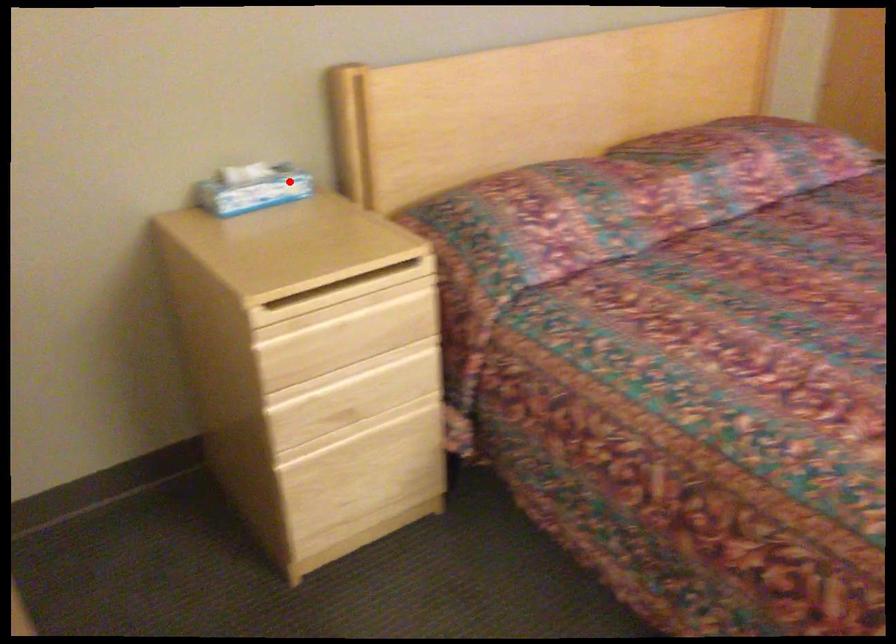
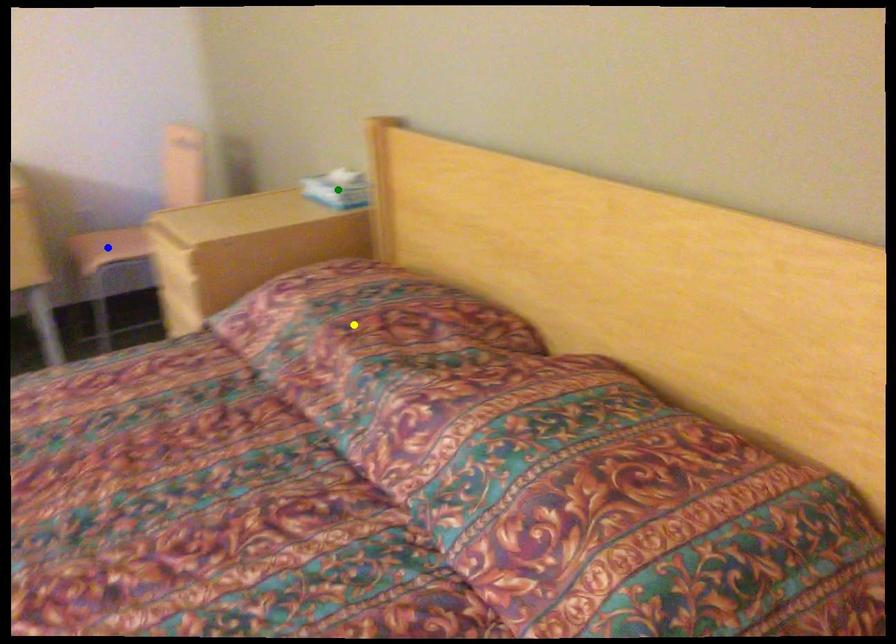
Question: I am providing you with two images of the same scene from different viewpoints. A red point is marked on the first image. You are given multiple points on the second image. Which point in image 2 represents the same 3d spot as the red point in image 1?

Choices:
 (A) yellow point
 (B) green point
 (C) blue point

Answer: (B)